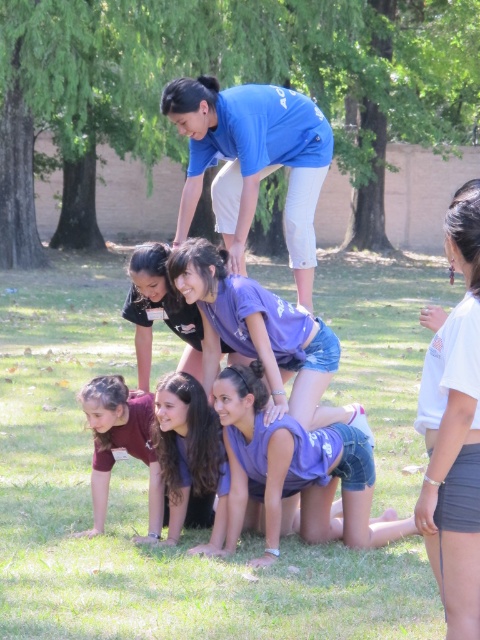
Question: Which point appears closest to the camera in this image?

Choices:
 (A) (80, 538)
 (B) (284, 424)
 (C) (284, 125)
 (D) (183, 285)

Answer: (B)

Question: Does blue cotton shirt at upper center lie behind purple cotton shirt at center?

Choices:
 (A) yes
 (B) no

Answer: (A)

Question: Is green grass at center in front of purple cotton shirt at center?

Choices:
 (A) yes
 (B) no

Answer: (A)

Question: Is blue cotton shirt at upper center thinner than maroon fabric shirt at lower left?

Choices:
 (A) no
 (B) yes

Answer: (A)

Question: Considering the real-world distances, which object is farthest from the purple cotton shirt at center?

Choices:
 (A) smooth purple shirt at lower center
 (B) green grass at center
 (C) purple denim shorts at lower center

Answer: (B)

Question: Which object appears closest to the camera in this image?

Choices:
 (A) white cotton t-shirt at lower right
 (B) blue cotton shirt at upper center
 (C) smooth purple shirt at lower center
 (D) purple denim shorts at lower center

Answer: (A)